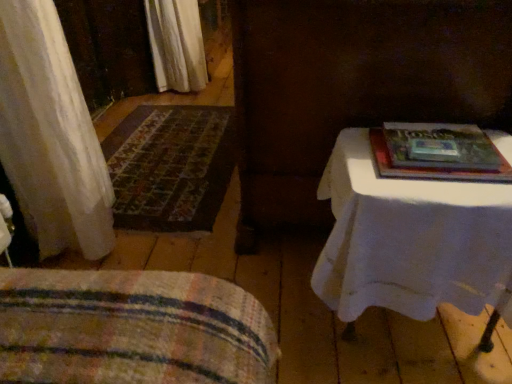
Question: Is hardcover book at upper right positioned before white cloth-covered table at right?

Choices:
 (A) yes
 (B) no

Answer: (B)

Question: Can you confirm if hardcover book at upper right is smaller than white cloth-covered table at right?

Choices:
 (A) yes
 (B) no

Answer: (A)

Question: Is hardcover book at upper right not near white cloth-covered table at right?

Choices:
 (A) yes
 (B) no

Answer: (B)

Question: From the image's perspective, would you say hardcover book at upper right is shown under white cloth-covered table at right?

Choices:
 (A) no
 (B) yes

Answer: (A)

Question: Is hardcover book at upper right facing away from white cloth-covered table at right?

Choices:
 (A) yes
 (B) no

Answer: (B)

Question: Considering the positions of carpeted mat at left and striped fabric blanket at lower left in the image, is carpeted mat at left bigger or smaller than striped fabric blanket at lower left?

Choices:
 (A) big
 (B) small

Answer: (B)

Question: Is carpeted mat at left inside or outside of striped fabric blanket at lower left?

Choices:
 (A) outside
 (B) inside

Answer: (A)

Question: Is carpeted mat at left taller or shorter than striped fabric blanket at lower left?

Choices:
 (A) tall
 (B) short

Answer: (B)

Question: Relative to striped fabric blanket at lower left, is carpeted mat at left in front or behind?

Choices:
 (A) front
 (B) behind

Answer: (B)

Question: Is hardcover book at upper right in front of or behind carpeted mat at left in the image?

Choices:
 (A) front
 (B) behind

Answer: (A)

Question: Based on their sizes in the image, would you say hardcover book at upper right is bigger or smaller than carpeted mat at left?

Choices:
 (A) small
 (B) big

Answer: (A)

Question: From a real-world perspective, is hardcover book at upper right physically located above or below carpeted mat at left?

Choices:
 (A) above
 (B) below

Answer: (A)

Question: Considering the relative positions of hardcover book at upper right and carpeted mat at left in the image provided, is hardcover book at upper right to the left or to the right of carpeted mat at left?

Choices:
 (A) left
 (B) right

Answer: (B)

Question: From the image's perspective, relative to carpeted mat at left, is striped fabric blanket at lower left above or below?

Choices:
 (A) below
 (B) above

Answer: (A)

Question: Based on their positions, is striped fabric blanket at lower left located to the left or right of carpeted mat at left?

Choices:
 (A) left
 (B) right

Answer: (B)